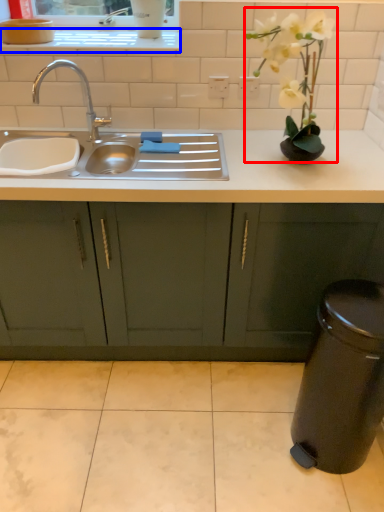
Question: Which point is further to the camera, floral arrangement (highlighted by a red box) or window sill (highlighted by a blue box)?

Choices:
 (A) floral arrangement
 (B) window sill

Answer: (B)